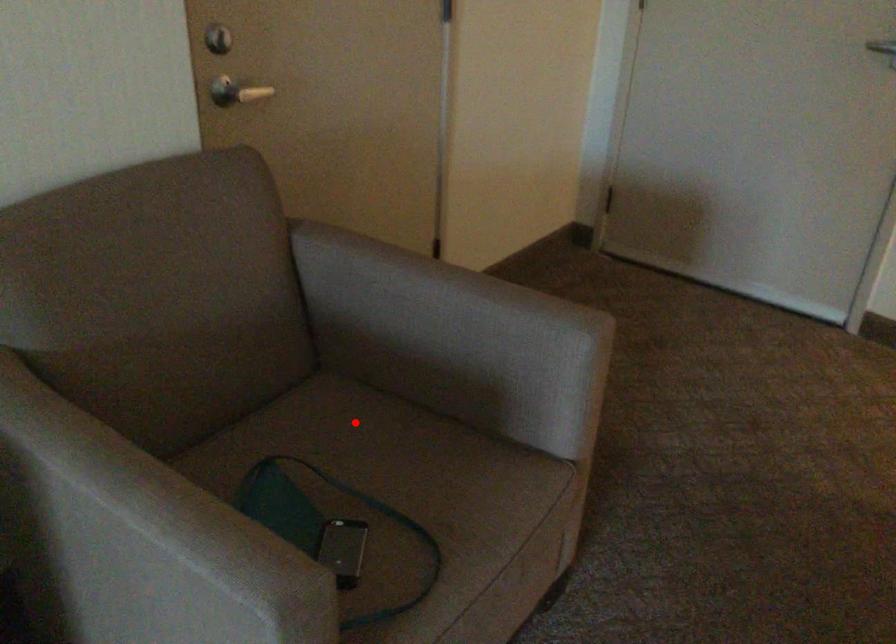
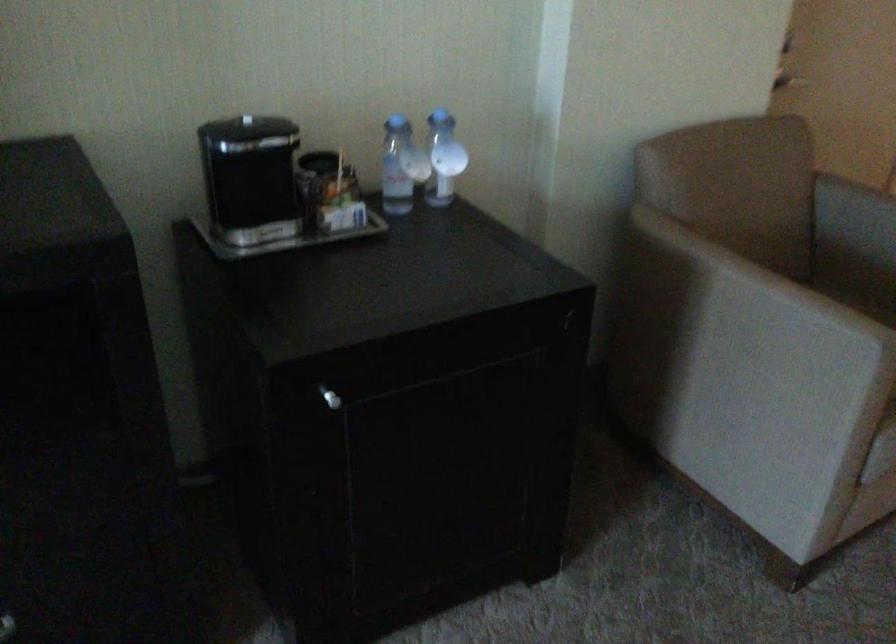
The point at the highlighted location is marked in the first image. Where is the corresponding point in the second image?

(859, 303)